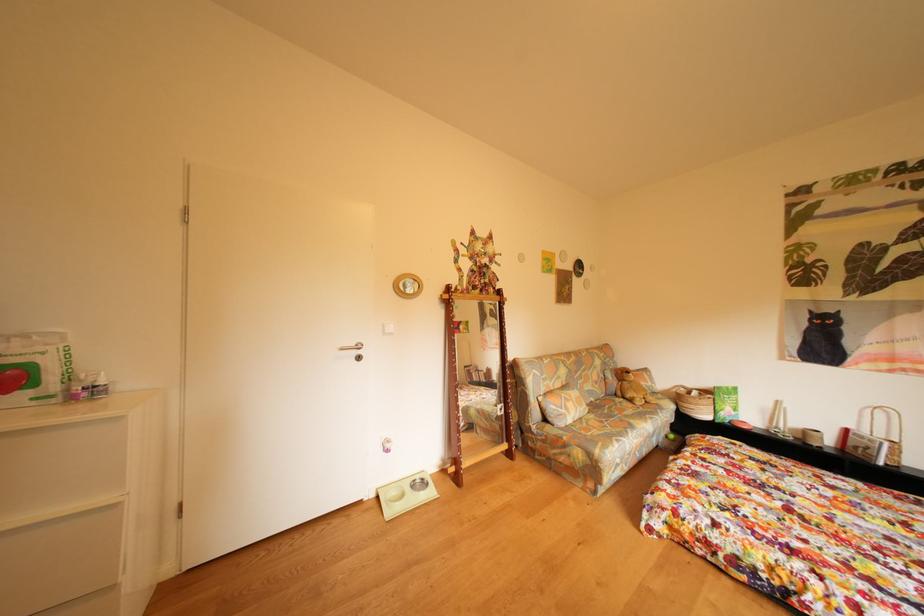
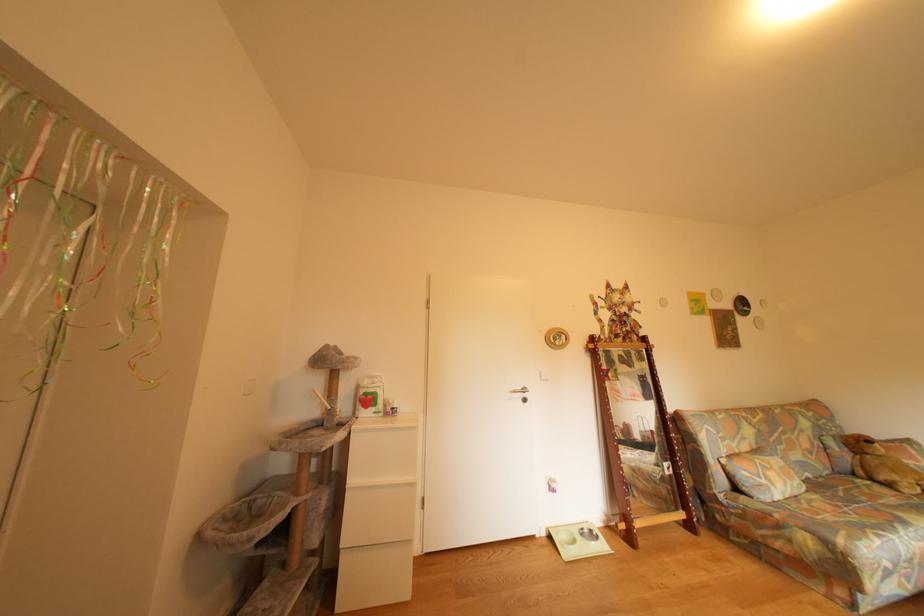
What movement of the cameraman would produce the second image?

The movement direction of the cameraman is left, backward.